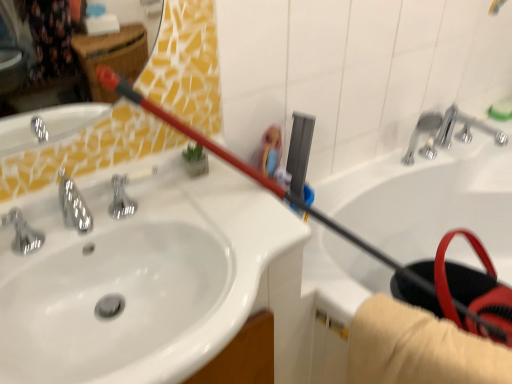
Identify the location of vacant space to the right of silver metallic faucet at left. (94, 229).